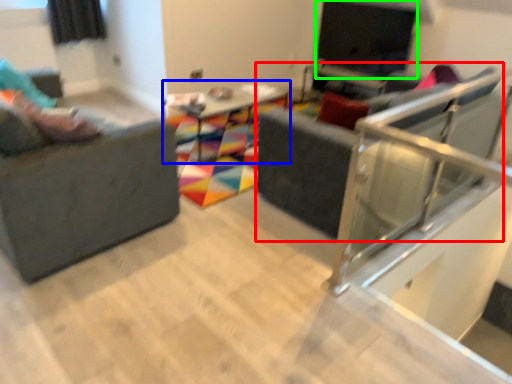
Question: Based on their relative distances, which object is farther from swivel chair (highlighted by a red box)? Choose from table (highlighted by a blue box) and window screen (highlighted by a green box).

Choices:
 (A) table
 (B) window screen

Answer: (B)